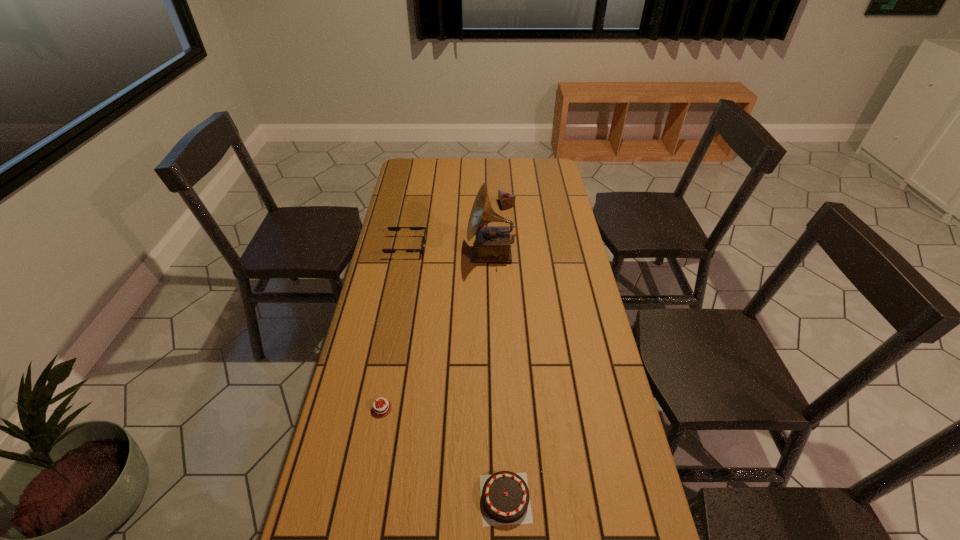
Locate an element on the screen. The image size is (960, 540). vacant space at the far left corner of the desktop is located at coordinates (403, 161).

This screenshot has height=540, width=960. What are the coordinates of `free space between the tallest object and the sunglasses` in the screenshot? It's located at (449, 250).

Find the location of a particular element. The image size is (960, 540). unoccupied area between the nearest object and the second tallest object is located at coordinates pyautogui.click(x=506, y=352).

Identify the location of free area in between the sunglasses and the fourth shortest object. This screenshot has height=540, width=960. (457, 226).

Image resolution: width=960 pixels, height=540 pixels. I want to click on vacant area that lies between the sunglasses and the tallest object, so click(449, 250).

Where is `free space between the second nearest chocolate cake and the fourth tallest object`? The height and width of the screenshot is (540, 960). free space between the second nearest chocolate cake and the fourth tallest object is located at coordinates (444, 454).

Identify the location of free space between the farthest object and the shortest chocolate cake. (444, 307).

You are a GUI agent. You are given a task and a screenshot of the screen. Output one action in this format:
    pyautogui.click(x=<x>, y=<y>)
    Task: Click on the free spot between the tallest object and the sunglasses
    The width and height of the screenshot is (960, 540).
    Given the screenshot: What is the action you would take?
    pyautogui.click(x=449, y=250)

Locate an element on the screen. The width and height of the screenshot is (960, 540). empty space between the sunglasses and the shortest object is located at coordinates (394, 327).

Image resolution: width=960 pixels, height=540 pixels. In order to click on empty location between the phonograph record and the sunglasses in this screenshot , I will do `click(449, 250)`.